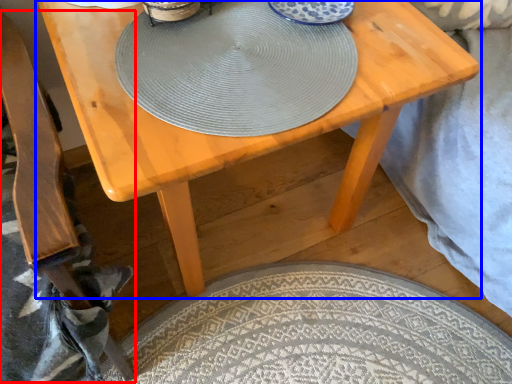
Question: Among these objects, which one is farthest to the camera, armchair (highlighted by a red box) or table (highlighted by a blue box)?

Choices:
 (A) armchair
 (B) table

Answer: (B)